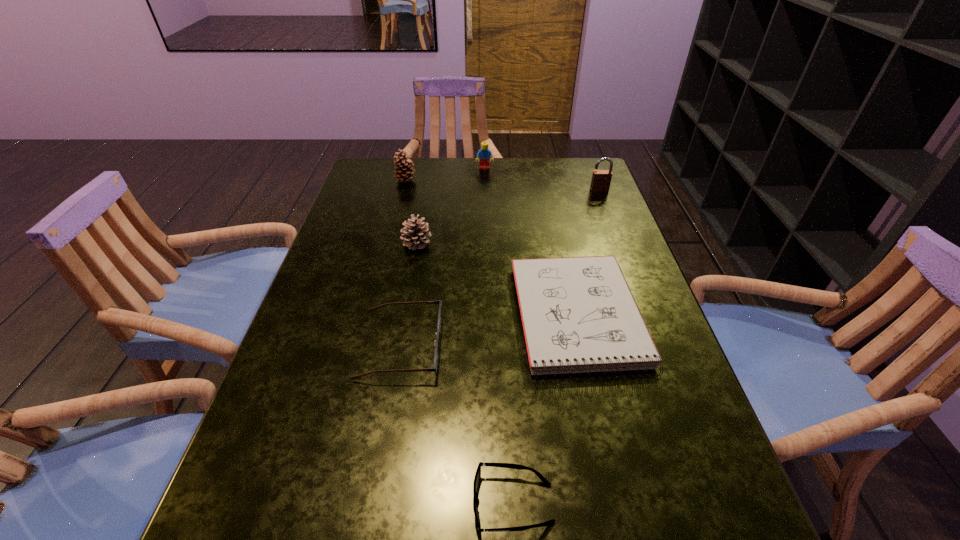
This screenshot has height=540, width=960. Identify the location of vacant space located on the front-facing side of the third farthest object. (631, 273).

This screenshot has height=540, width=960. What are the coordinates of `free region located 0.290m on the right of the sixth nearest object` in the screenshot? It's located at (508, 180).

At what (x,y) coordinates should I click in order to perform the action: click on vacant space located on the face of the Lego. Please return your answer as a coordinate pair (x, y). Looking at the image, I should click on (485, 179).

At what (x,y) coordinates should I click in order to perform the action: click on vacant area located 0.310m on the front of the fourth farthest object. Please return your answer as a coordinate pair (x, y). Looking at the image, I should click on (398, 349).

At what (x,y) coordinates should I click in order to perform the action: click on free space located 0.120m on the front-facing side of the spectacles. Please return your answer as a coordinate pair (x, y). This screenshot has width=960, height=540. Looking at the image, I should click on (499, 345).

I want to click on vacant space positioned 0.250m on the front of the notepad, so click(625, 534).

What are the coordinates of `vacant space situated on the front-facing side of the nearest object` in the screenshot? It's located at (309, 503).

Identify the location of free space located on the front-facing side of the nearest object. Image resolution: width=960 pixels, height=540 pixels. (348, 503).

Identify the location of vacant space located on the front-facing side of the nearest object. (375, 503).

The height and width of the screenshot is (540, 960). What are the coordinates of `padlock present at the far edge` in the screenshot? It's located at (601, 179).